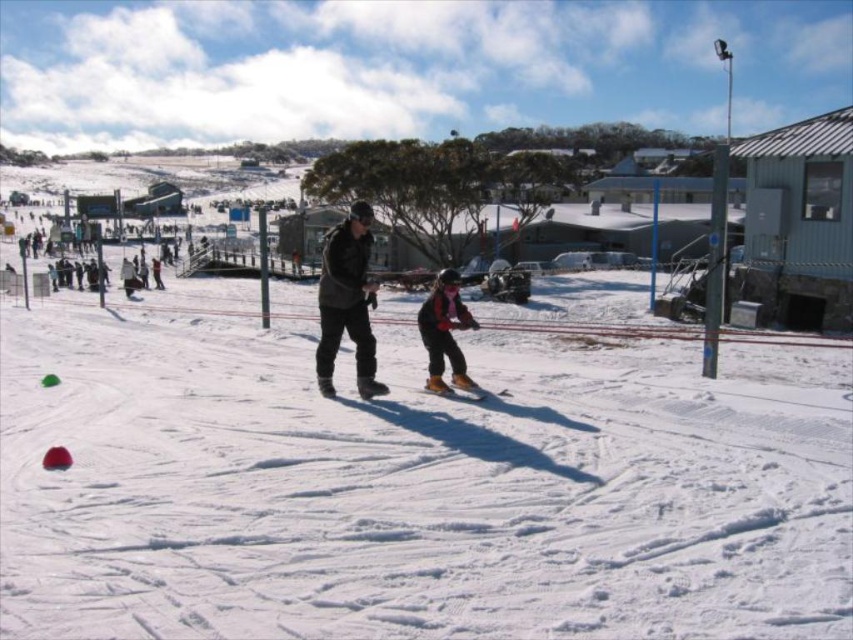
Question: Observing the image, what is the correct spatial positioning of white matte snow at center in reference to shiny orange ski at center?

Choices:
 (A) above
 (B) below

Answer: (A)

Question: Does dark gray jacket at center have a larger size compared to shiny orange ski at center?

Choices:
 (A) yes
 (B) no

Answer: (A)

Question: Can you confirm if dark gray jacket at center is positioned to the right of shiny orange ski at center?

Choices:
 (A) yes
 (B) no

Answer: (B)

Question: Among these points, which one is farthest from the camera?

Choices:
 (A) (357, 288)
 (B) (456, 387)
 (C) (457, 307)
 (D) (482, 604)

Answer: (B)

Question: Which of the following is the farthest from the observer?

Choices:
 (A) (436, 300)
 (B) (461, 396)
 (C) (674, 518)

Answer: (A)

Question: Which object is farther from the camera taking this photo?

Choices:
 (A) shiny orange ski at center
 (B) dark gray jacket at center
 (C) orange ski boots at center

Answer: (C)